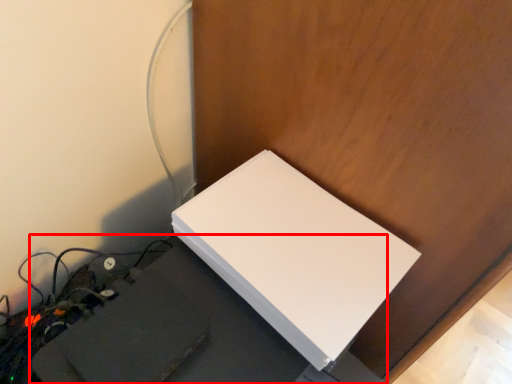
Question: In this image, where is computer desk (annotated by the red box) located relative to Wii?

Choices:
 (A) right
 (B) left

Answer: (B)